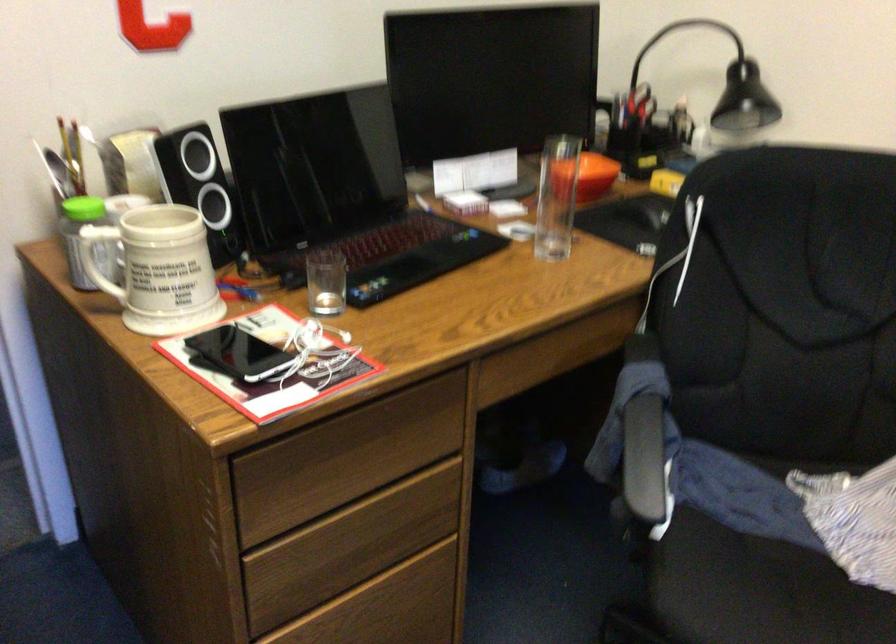
At what (x,y) coordinates should I click in order to perform the action: click on orange bowl. Please return your answer as a coordinate pair (x, y). Looking at the image, I should click on (590, 176).